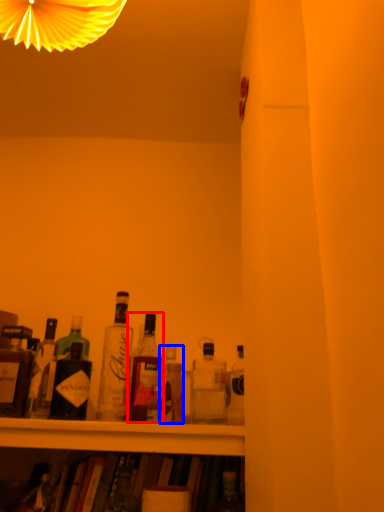
Question: Among these objects, which one is farthest to the camera, bottle (highlighted by a red box) or bottle (highlighted by a blue box)?

Choices:
 (A) bottle
 (B) bottle

Answer: (A)